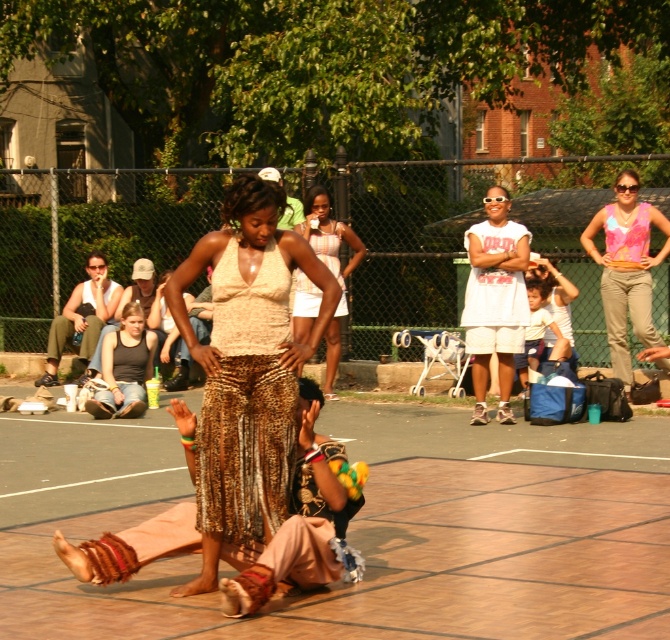
Question: Is leopard print skirt at center smaller than white cotton shirt at center?

Choices:
 (A) yes
 (B) no

Answer: (B)

Question: Among these points, which one is nearest to the camera?

Choices:
 (A) (304, 317)
 (B) (253, 525)
 (C) (86, 348)

Answer: (B)

Question: Can you confirm if white cotton dress at center is wider than leopard print fabric dress at center?

Choices:
 (A) no
 (B) yes

Answer: (B)

Question: In this image, where is brown leather court at center located relative to white cotton shirt at center?

Choices:
 (A) right
 (B) left

Answer: (B)

Question: Which object appears closest to the camera in this image?

Choices:
 (A) pink floral tank top at center
 (B) leopard print fabric dress at center
 (C) white cotton dress at center
 (D) leopard print skirt at center

Answer: (D)

Question: Among these points, which one is nearest to the camera?

Choices:
 (A) (249, 428)
 (B) (293, 314)
 (C) (498, 205)
 (D) (334, 248)

Answer: (A)